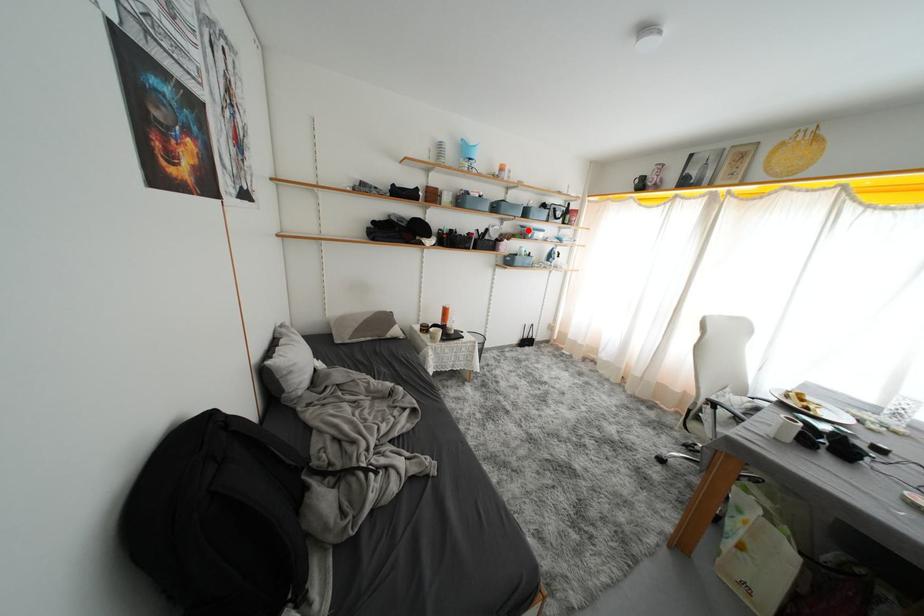
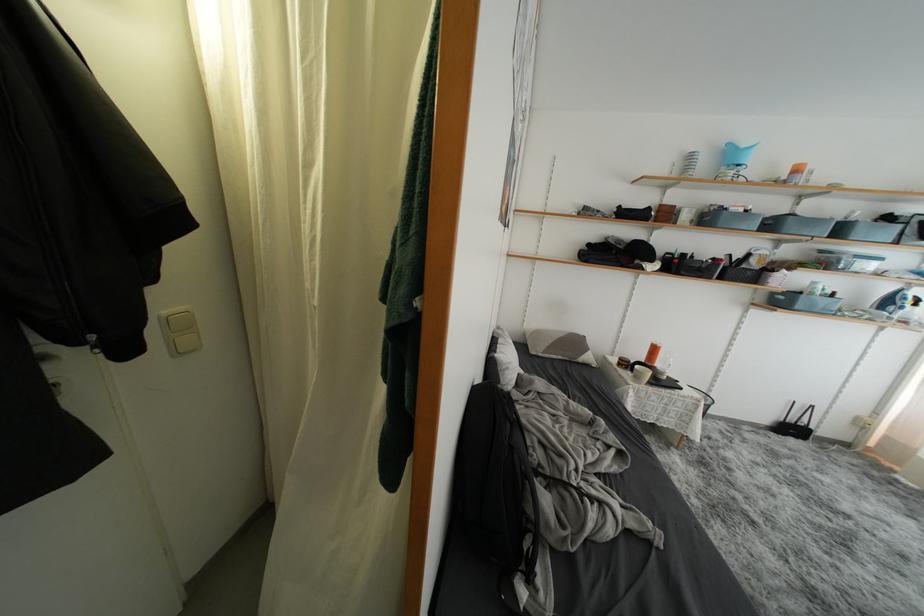
Question: I am providing you with two images of the same scene from different viewpoints. Given a red point in image1, look at the same physical point in image2. Is it:

Choices:
 (A) Closer to the viewpoint
 (B) Farther from the viewpoint

Answer: (B)